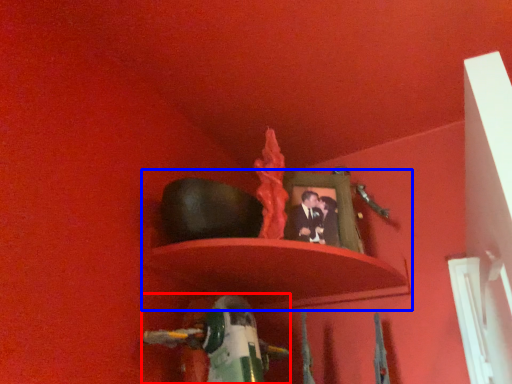
Question: Which point is further to the camera, toy (highlighted by a red box) or shelf (highlighted by a blue box)?

Choices:
 (A) toy
 (B) shelf

Answer: (B)